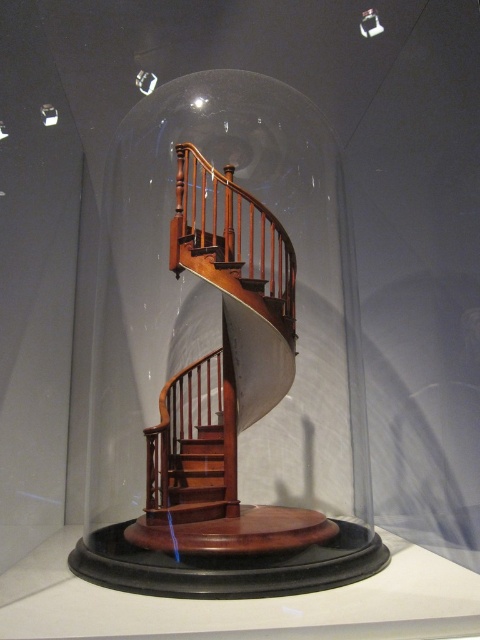
Question: Can you confirm if mahogany wood railing at center is positioned to the left of mahogany wood stairs at center?

Choices:
 (A) no
 (B) yes

Answer: (A)

Question: Does mahogany wood railing at center appear over mahogany wood stairs at center?

Choices:
 (A) yes
 (B) no

Answer: (A)

Question: Which of these objects is positioned farthest from the mahogany wood stairs at center?

Choices:
 (A) transparent glass dome at center
 (B) mahogany wood railing at center

Answer: (B)

Question: Is transparent glass dome at center wider than mahogany wood stairs at center?

Choices:
 (A) no
 (B) yes

Answer: (B)

Question: Among these points, which one is farthest from the camera?

Choices:
 (A) (201, 433)
 (B) (176, 173)

Answer: (A)

Question: Estimate the real-world distances between objects in this image. Which object is closer to the mahogany wood stairs at center?

Choices:
 (A) transparent glass dome at center
 (B) mahogany wood railing at center

Answer: (A)